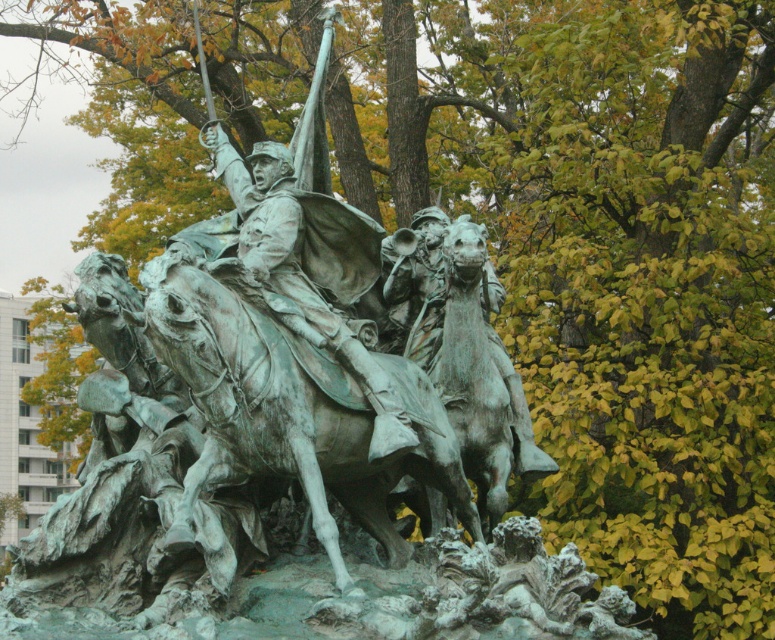
You are a tour guide leading a group around an art exhibition. You notice the green patina horse at center and the green patina statue at center. Can you tell the visitors how far apart these two objects are?

The green patina horse at center is 3.05 meters away from the green patina statue at center.

What is the significance of the point marked at coordinates (x=288, y=413) in the sculpture?

The point marked at coordinates (x=288, y=413) marks the location of the green patina horse at center.

Looking at the bronze sculpture of soldiers on horseback, you notice the green patina horse at center and the green patina statue at center. Which one has a greater height?

The green patina statue at center is taller than the green patina horse at center.